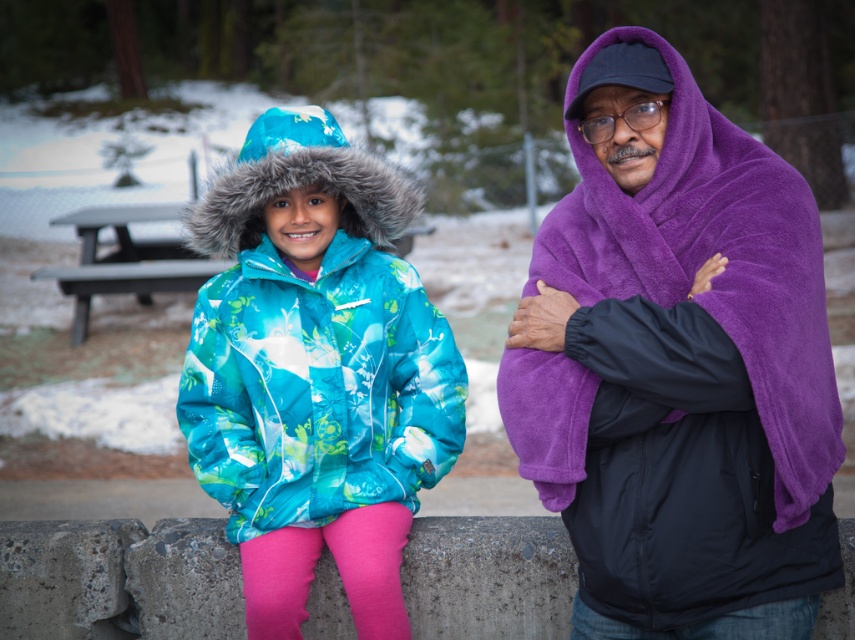
Is point (761, 362) closer to camera compared to point (345, 456)?

Yes, it is in front of point (345, 456).

Is purple fleece blanket at right below shiny blue jacket at center?

No.

This screenshot has height=640, width=855. What are the coordinates of `purple fleece blanket at right` in the screenshot? It's located at (677, 364).

Does purple fleece blanket at right have a lesser width compared to gray wooden picnic table at center?

Yes.

Can you confirm if purple fleece blanket at right is positioned to the right of gray wooden picnic table at center?

Correct, you'll find purple fleece blanket at right to the right of gray wooden picnic table at center.

Between point (823, 324) and point (162, 262), which one is positioned behind?

Point (162, 262)

The image size is (855, 640). I want to click on purple fleece blanket at right, so pos(677,364).

Can you confirm if shiny blue jacket at center is positioned above gray wooden picnic table at center?

No.

Who is taller, shiny blue jacket at center or gray wooden picnic table at center?

With more height is shiny blue jacket at center.

Is point (404, 208) farther from viewer compared to point (145, 209)?

No.

Identify the location of shiny blue jacket at center. (316, 371).